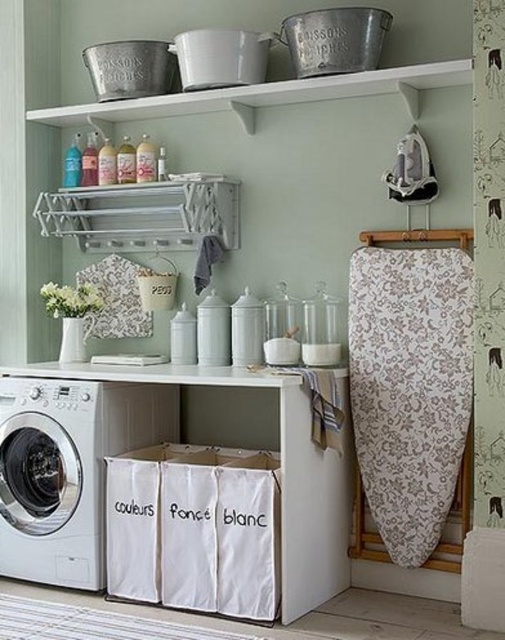
Question: From the image, what is the correct spatial relationship of floral-patterned fabric at right in relation to white fabric laundry basket at lower center?

Choices:
 (A) above
 (B) below

Answer: (A)

Question: Where is white fabric laundry basket at lower center located in relation to white matte washing machine at lower left in the image?

Choices:
 (A) below
 (B) above

Answer: (A)

Question: Is floral-patterned fabric at right to the right of white matte washing machine at lower left from the viewer's perspective?

Choices:
 (A) no
 (B) yes

Answer: (B)

Question: Which object is farther from the camera taking this photo?

Choices:
 (A) floral-patterned fabric at right
 (B) white matte washing machine at lower left
 (C) white fabric laundry basket at lower center

Answer: (B)

Question: Among these objects, which one is farthest from the camera?

Choices:
 (A) white matte washing machine at lower left
 (B) white fabric laundry basket at lower center
 (C) floral-patterned fabric at right

Answer: (A)

Question: Which of the following is the farthest from the observer?

Choices:
 (A) (16, 552)
 (B) (197, 465)

Answer: (B)